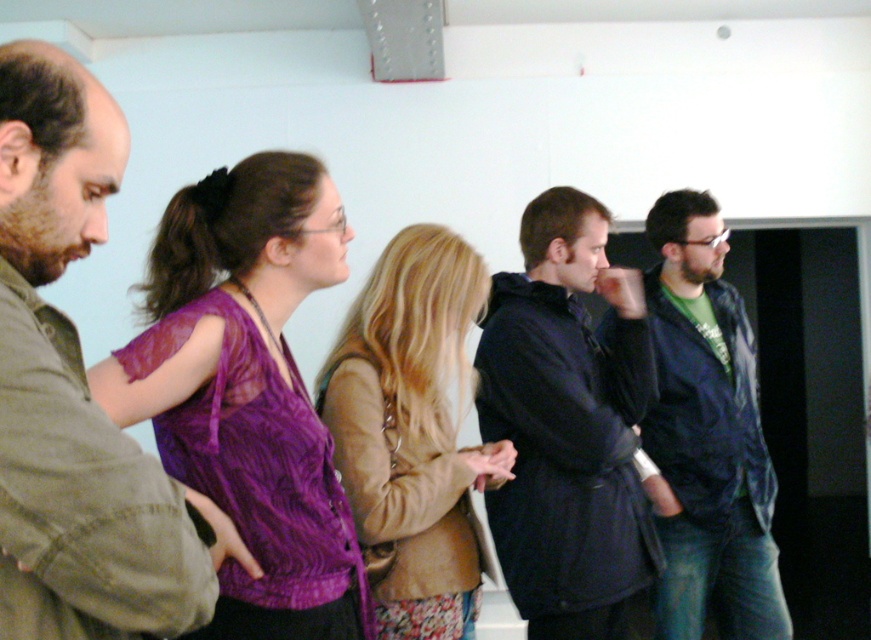
Who is positioned more to the right, purple sheer blouse at center or dark blue coat at center?

dark blue coat at center

Between purple sheer blouse at center and dark blue coat at center, which one has less height?

Standing shorter between the two is purple sheer blouse at center.

Is point (190, 244) less distant than point (514, 289)?

Yes.

I want to click on purple sheer blouse at center, so click(x=248, y=390).

Can you confirm if purple sheer blouse at center is positioned above matte purple blouse at center?

Correct, purple sheer blouse at center is located above matte purple blouse at center.

Who is higher up, purple sheer blouse at center or matte purple blouse at center?

purple sheer blouse at center

Who is more forward, (220, 444) or (352, 472)?

Positioned in front is point (220, 444).

Find the location of a particular element. purple sheer blouse at center is located at coordinates (248, 390).

Describe the element at coordinates (78, 394) in the screenshot. This screenshot has width=871, height=640. I see `matte green shirt at left` at that location.

Locate an element on the screen. matte green shirt at left is located at coordinates (78, 394).